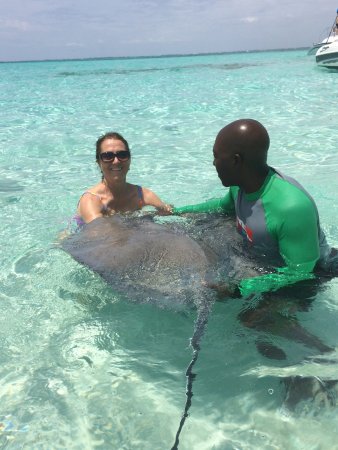
Identify the location of rod. Image resolution: width=338 pixels, height=450 pixels. (186, 401).